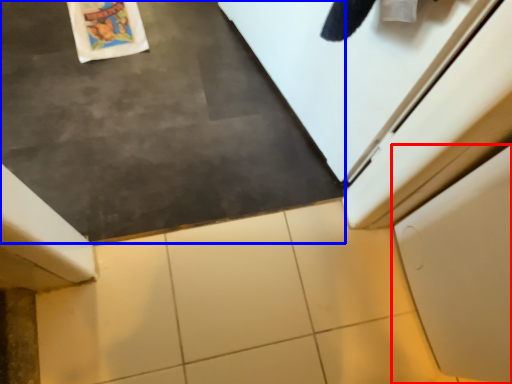
Question: Which of the following is the closest to the observer, cabinetry (highlighted by a red box) or slate (highlighted by a blue box)?

Choices:
 (A) cabinetry
 (B) slate

Answer: (B)